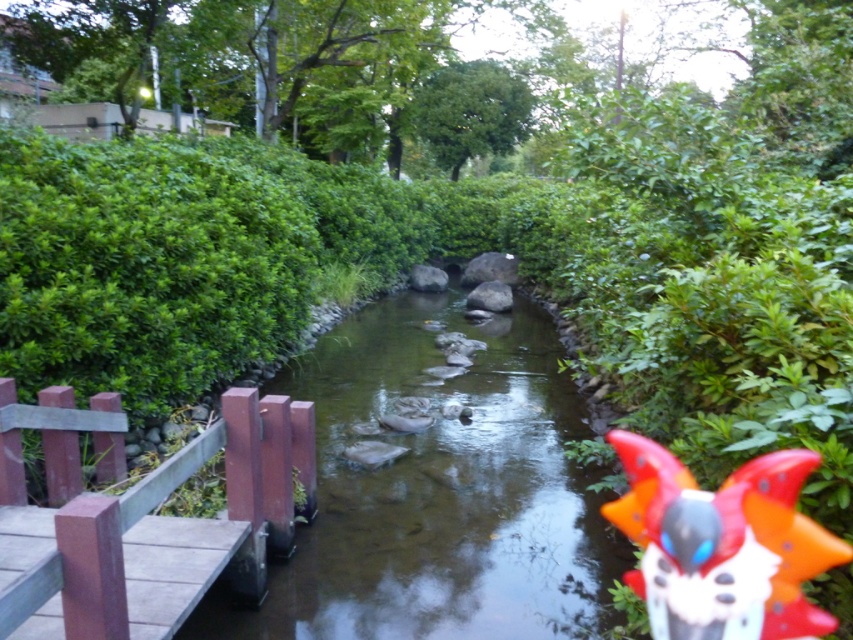
Measure the distance between wooden bridge rail at left and shiny plastic toy at right.

wooden bridge rail at left and shiny plastic toy at right are 4.65 feet apart from each other.

Is point (45, 580) closer to viewer compared to point (734, 538)?

That is True.

The height and width of the screenshot is (640, 853). Find the location of `wooden bridge rail at left`. wooden bridge rail at left is located at coordinates (166, 531).

Which is in front, point (705, 616) or point (421, 122)?

Point (705, 616)

Is point (827, 566) closer to camera compared to point (440, 84)?

That is True.

Describe the element at coordinates (722, 545) in the screenshot. This screenshot has width=853, height=640. I see `shiny plastic toy at right` at that location.

Identify the location of shiny plastic toy at right. The image size is (853, 640). (722, 545).

Is smooth brown stream at center shorter than shiny plastic toy at right?

Yes.

What do you see at coordinates (438, 490) in the screenshot? The height and width of the screenshot is (640, 853). I see `smooth brown stream at center` at bounding box center [438, 490].

In order to click on smooth brown stream at center in this screenshot , I will do `click(438, 490)`.